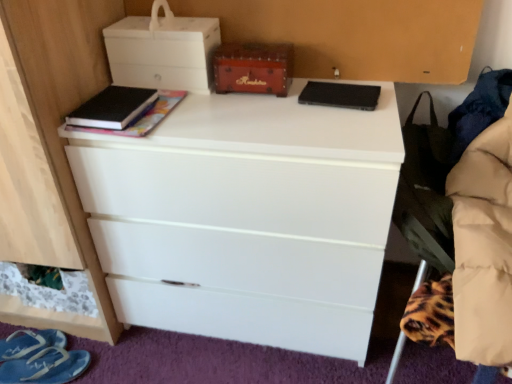
Identify the location of vacant space in front of black matte speaker at upper center, placed as the first book when sorted from right to left. The height and width of the screenshot is (384, 512). (346, 125).